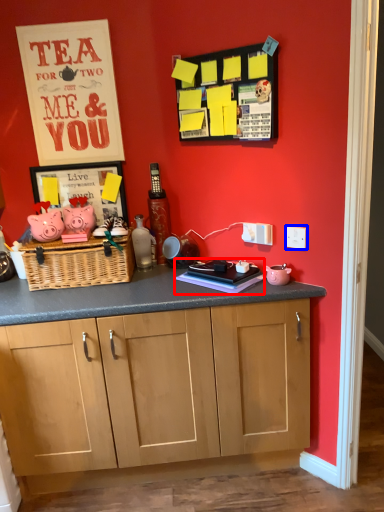
Question: Which object appears closest to the camera in this image, book (highlighted by a red box) or electric outlet (highlighted by a blue box)?

Choices:
 (A) book
 (B) electric outlet

Answer: (B)